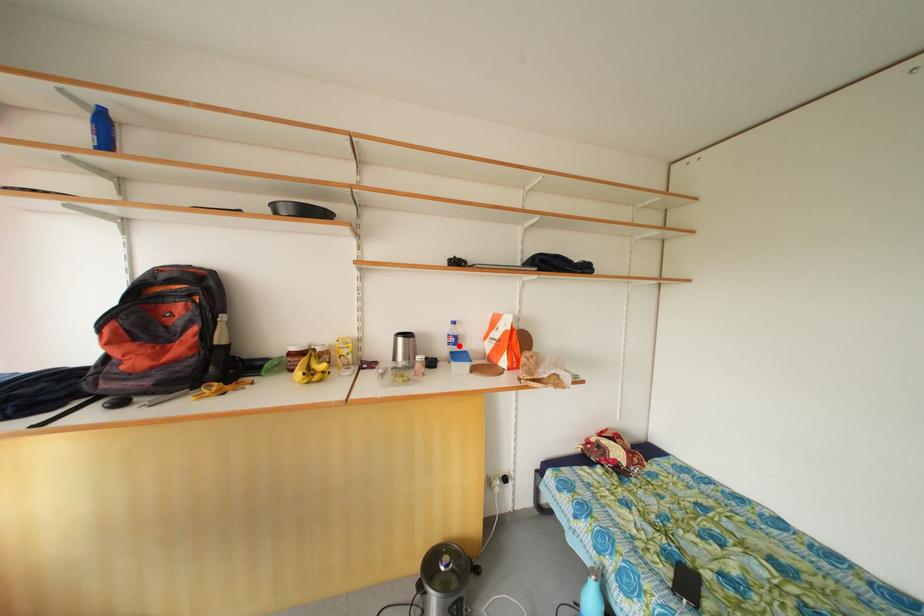
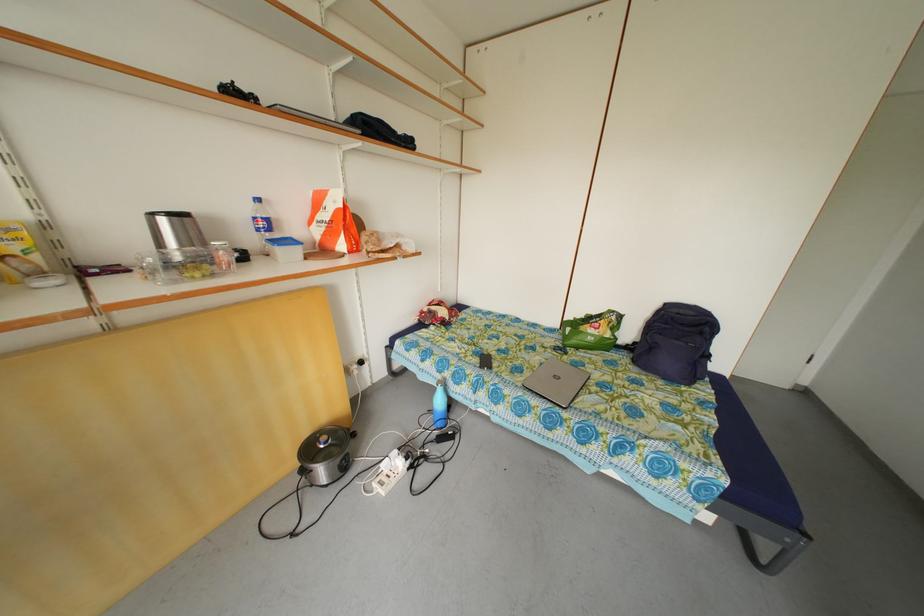
Locate, in the second image, the point that corresponds to the highlighted location in the first image.

(270, 230)